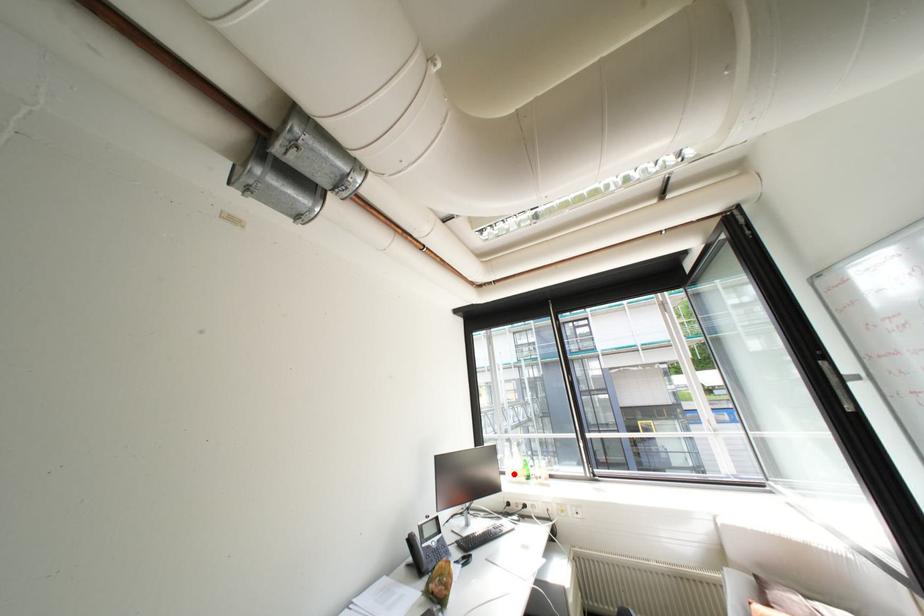
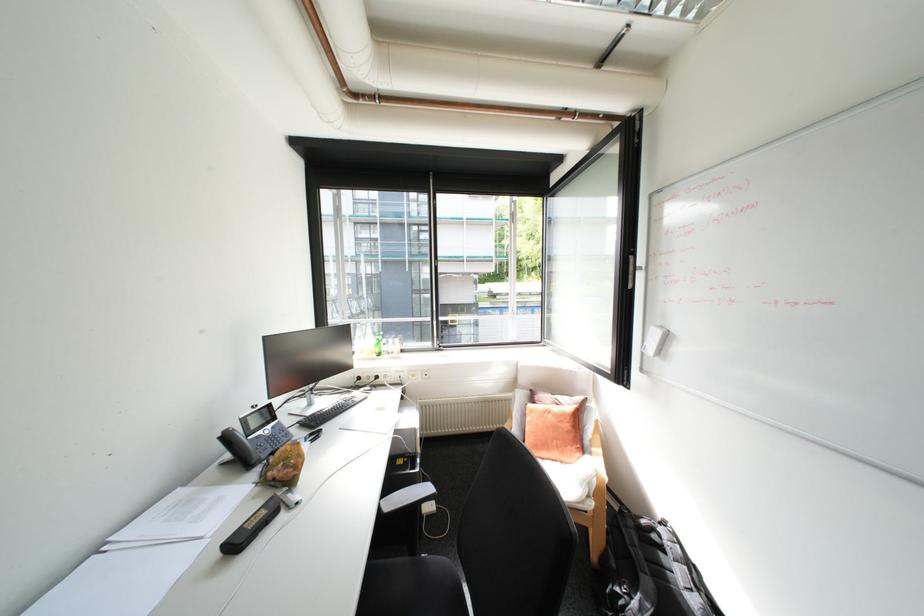
Where in the second image is the point corresponding to the highlighted location from the first image?

(362, 353)